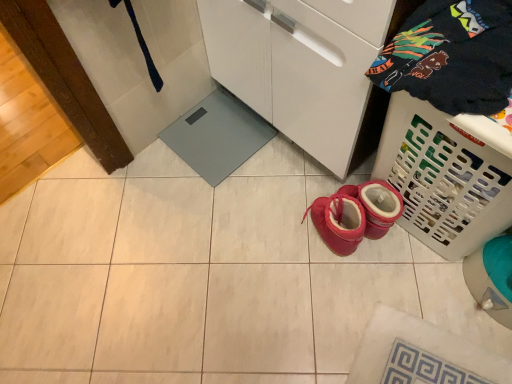
Question: From the image's perspective, is white plastic laundry basket at lower right located above or below dark blue cotton t-shirt at upper right?

Choices:
 (A) above
 (B) below

Answer: (B)

Question: Considering the positions of white plastic laundry basket at lower right and dark blue cotton t-shirt at upper right in the image, is white plastic laundry basket at lower right wider or thinner than dark blue cotton t-shirt at upper right?

Choices:
 (A) thin
 (B) wide

Answer: (A)

Question: Is white plastic laundry basket at lower right in front of or behind dark blue cotton t-shirt at upper right in the image?

Choices:
 (A) front
 (B) behind

Answer: (B)

Question: Considering their positions, is dark blue cotton t-shirt at upper right located in front of or behind white plastic laundry basket at lower right?

Choices:
 (A) behind
 (B) front

Answer: (B)

Question: Considering the positions of dark blue cotton t-shirt at upper right and white plastic laundry basket at lower right in the image, is dark blue cotton t-shirt at upper right taller or shorter than white plastic laundry basket at lower right?

Choices:
 (A) tall
 (B) short

Answer: (B)

Question: From the image's perspective, is dark blue cotton t-shirt at upper right above or below white plastic laundry basket at lower right?

Choices:
 (A) below
 (B) above

Answer: (B)

Question: Would you say dark blue cotton t-shirt at upper right is inside or outside white plastic laundry basket at lower right?

Choices:
 (A) inside
 (B) outside

Answer: (B)